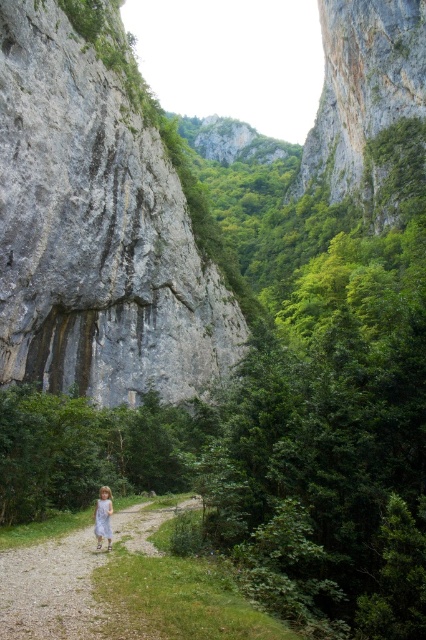
You are a hiker standing at the base of the rough stone cliff at upper center. You want to take a photo of the cliff with your camera. Given that your camera can focus on objects up to 300 feet away, will you be able to capture the cliff clearly in your photo?

The distance of rough stone cliff at upper center from camera is 279.51 feet, which is within the camera focus range of up to 300 feet. Therefore, you can capture the cliff clearly.

You are a hiker standing at the bottom of the canyon and see the rough stone cliff at upper center and the white lace dress at lower left. Which object is higher in elevation?

The rough stone cliff at upper center is positioned over the white lace dress at lower left, so it is higher in elevation.

You are planning a hiking trip and see the rough stone cliff at upper center and the gravel path at center in the image. Which one is higher in elevation?

The rough stone cliff at upper center is much taller than the gravel path at center, so it is higher in elevation.